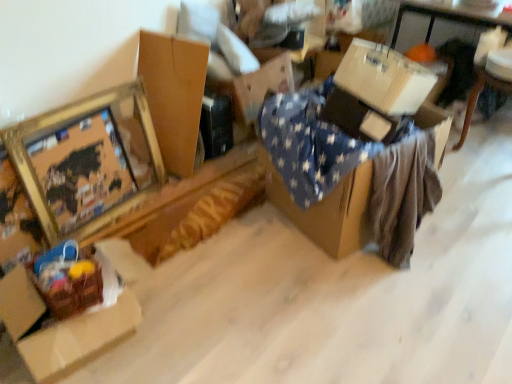
Question: Can you confirm if gold metallic picture frame at upper left is shorter than white corrugated cardboard box at upper right, acting as the third cardboard box starting from the left?

Choices:
 (A) no
 (B) yes

Answer: (A)

Question: Can you confirm if gold metallic picture frame at upper left is positioned to the right of white corrugated cardboard box at upper right, the 1th cardboard box positioned from the right?

Choices:
 (A) no
 (B) yes

Answer: (A)

Question: Is gold metallic picture frame at upper left thinner than white corrugated cardboard box at upper right, the 1th cardboard box positioned from the right?

Choices:
 (A) no
 (B) yes

Answer: (B)

Question: Does gold metallic picture frame at upper left lie behind white corrugated cardboard box at upper right, the 1th cardboard box positioned from the right?

Choices:
 (A) yes
 (B) no

Answer: (B)

Question: Is gold metallic picture frame at upper left far away from white corrugated cardboard box at upper right, the 1th cardboard box positioned from the right?

Choices:
 (A) yes
 (B) no

Answer: (A)

Question: From a real-world perspective, is white corrugated cardboard box at upper right, the 1th cardboard box positioned from the right, above or below brown cardboard box at upper left, which is the second cardboard box in left-to-right order?

Choices:
 (A) above
 (B) below

Answer: (A)

Question: Is white corrugated cardboard box at upper right, the 1th cardboard box positioned from the right, in front of or behind brown cardboard box at upper left, which is the 2th cardboard box from right to left, in the image?

Choices:
 (A) behind
 (B) front

Answer: (B)

Question: Considering the positions of point (355, 77) and point (164, 69), is point (355, 77) closer or farther from the camera than point (164, 69)?

Choices:
 (A) closer
 (B) farther

Answer: (A)

Question: Based on their sizes in the image, would you say white corrugated cardboard box at upper right, acting as the third cardboard box starting from the left, is bigger or smaller than brown cardboard box at upper left, which is the second cardboard box in left-to-right order?

Choices:
 (A) big
 (B) small

Answer: (A)

Question: From the image's perspective, relative to white corrugated cardboard box at upper right, acting as the third cardboard box starting from the left, is brown cardboard box at lower left, which is the 3th cardboard box in right-to-left order, above or below?

Choices:
 (A) above
 (B) below

Answer: (B)

Question: From a real-world perspective, is brown cardboard box at lower left, which is the first cardboard box from left to right, above or below white corrugated cardboard box at upper right, the 1th cardboard box positioned from the right?

Choices:
 (A) above
 (B) below

Answer: (B)

Question: Is brown cardboard box at lower left, which is the first cardboard box from left to right, in front of or behind white corrugated cardboard box at upper right, the 1th cardboard box positioned from the right, in the image?

Choices:
 (A) front
 (B) behind

Answer: (A)

Question: Considering the positions of brown cardboard box at lower left, which is the first cardboard box from left to right, and white corrugated cardboard box at upper right, acting as the third cardboard box starting from the left, in the image, is brown cardboard box at lower left, which is the first cardboard box from left to right, wider or thinner than white corrugated cardboard box at upper right, acting as the third cardboard box starting from the left,?

Choices:
 (A) thin
 (B) wide

Answer: (B)

Question: Based on their positions, is white cardboard box at upper right, the 1th table when ordered from right to left, located to the left or right of gold metallic picture frame at upper left?

Choices:
 (A) right
 (B) left

Answer: (A)

Question: Is white cardboard box at upper right, which is counted as the 1th table, starting from the back, taller or shorter than gold metallic picture frame at upper left?

Choices:
 (A) tall
 (B) short

Answer: (A)